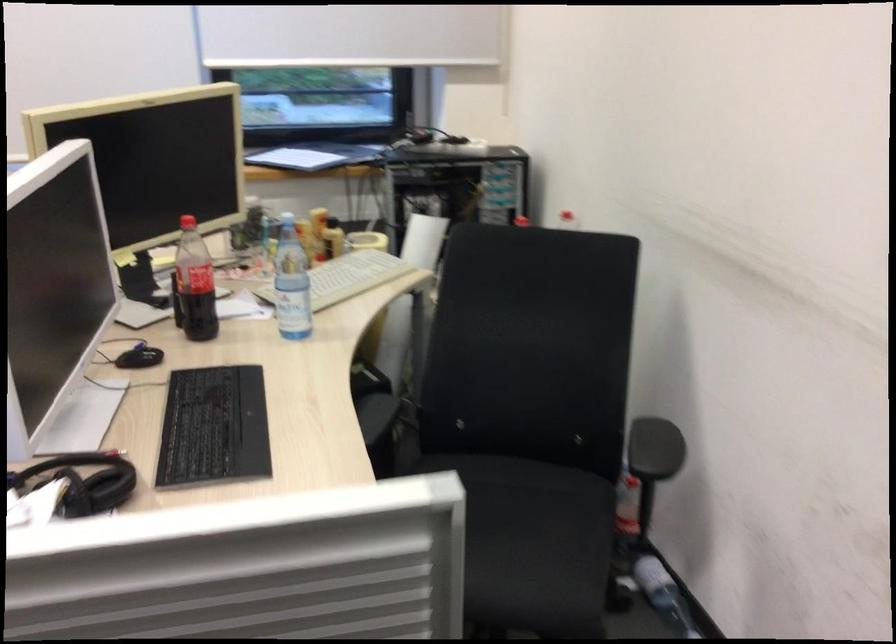
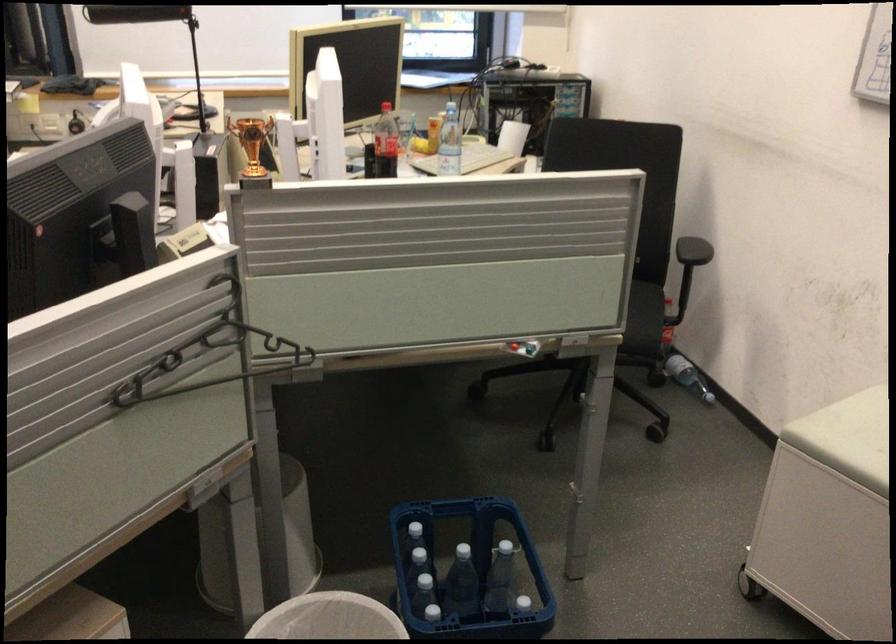
Question: I am providing you with two images of the same scene from different viewpoints. After the viewpoint changes to image2, which objects are now occluded?

Choices:
 (A) black headphones
 (B) white water pitcher
 (C) chair sitting surface
 (D) red button

Answer: (A)